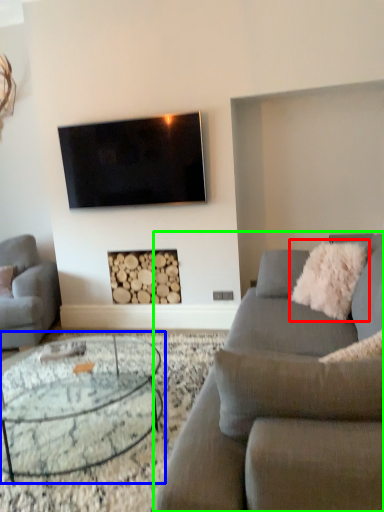
Question: Which is farther away from pillow (highlighted by a red box)? coffee table (highlighted by a blue box) or studio couch (highlighted by a green box)?

Choices:
 (A) coffee table
 (B) studio couch

Answer: (A)